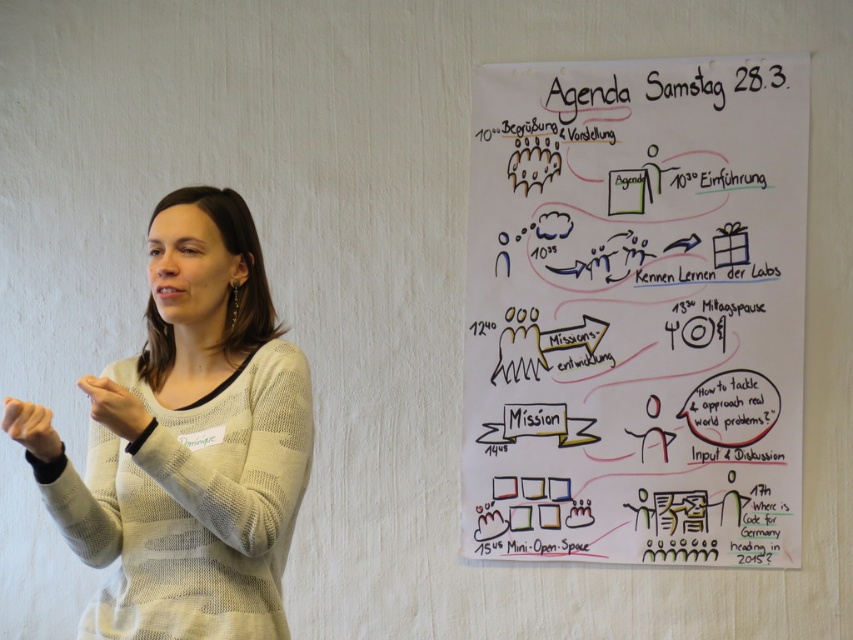
You are an attendee at a meeting and notice the white paper at upper right and the matte white hand at center. Which object is closer to you?

The white paper at upper right is closer to you because the matte white hand at center is behind it.

You are standing in front of the whiteboard and want to point to the point at position (242, 540) on the whiteboard. If you are 1.75 meters away from the point, can you reach it with your arm extended straight out?

The point at position (242, 540) is 1.75 meters away from you. The average human arm length is about 0.7 meters, so you would need to move closer to reach it.

You are standing at the camera position and want to point to the point at coordinates (662,483) on the whiteboard. How far will your finger need to reach?

The point at coordinates (662,483) is 9.04 feet away from the camera, so your finger needs to reach 9.04 feet to point to it.